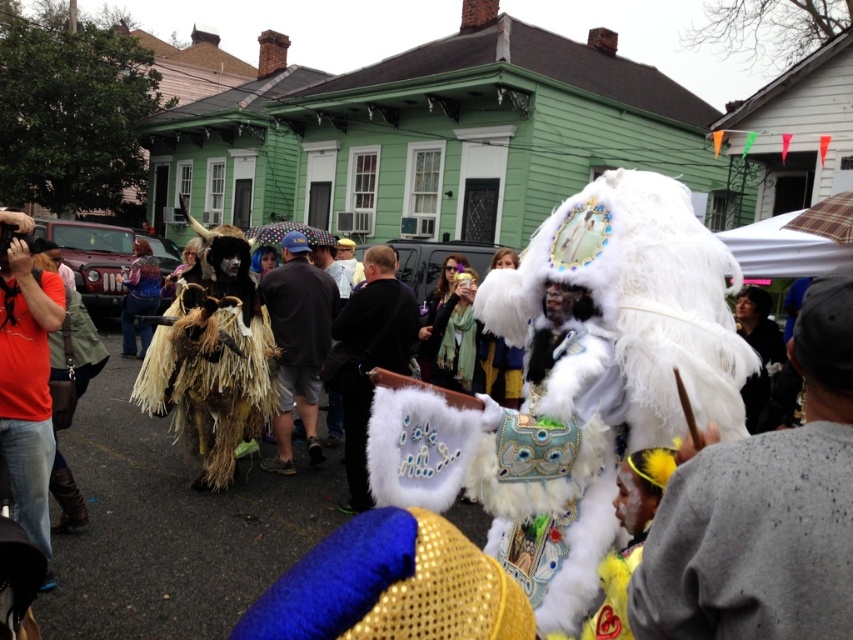
Question: Does matte red shirt at left appear under brown straw costume at center?

Choices:
 (A) no
 (B) yes

Answer: (B)

Question: Does matte red shirt at left lie behind brown straw costume at center?

Choices:
 (A) no
 (B) yes

Answer: (A)

Question: Which object appears closest to the camera in this image?

Choices:
 (A) shiny black jacket at center
 (B) matte red shirt at left

Answer: (B)

Question: Can you confirm if matte red shirt at left is positioned above brown straw costume at center?

Choices:
 (A) yes
 (B) no

Answer: (B)

Question: Which point appears farthest from the camera in this image?

Choices:
 (A) (345, 256)
 (B) (328, 310)
 (C) (347, 465)

Answer: (A)

Question: Which object is farther from the camera taking this photo?

Choices:
 (A) white fluffy costume at center
 (B) white fluffy headdress at center
 (C) matte red shirt at left
 (D) brown straw costume at center

Answer: (D)